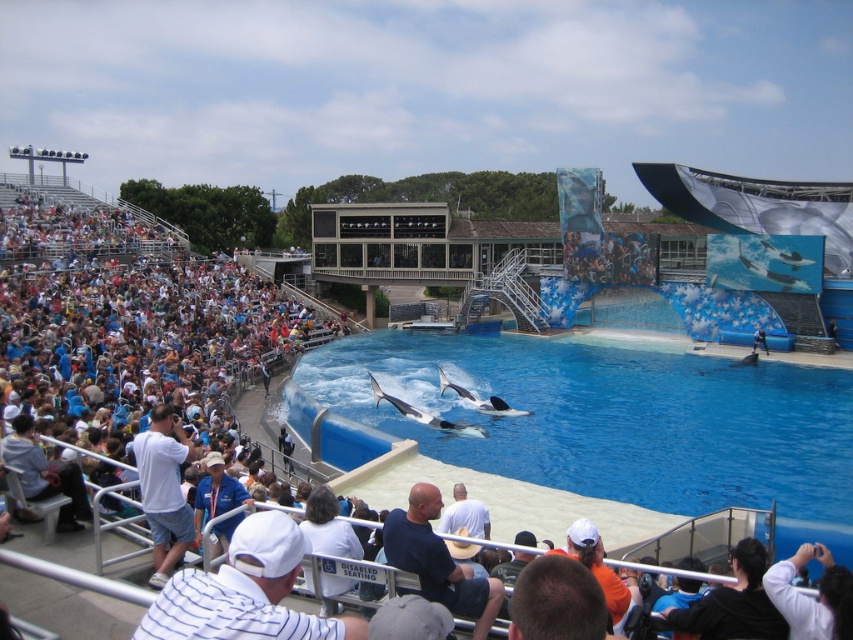
Which of these two, dark blue shirt at lower center or white smooth dolphin at center, stands taller?

dark blue shirt at lower center

Which is behind, point (384, 545) or point (442, 372)?

The point (442, 372) is more distant.

Locate an element on the screen. dark blue shirt at lower center is located at coordinates (438, 561).

Is blue smooth water at center positioned behind white cotton shirt at center?

Yes.

Between blue smooth water at center and white cotton shirt at center, which one appears on the left side from the viewer's perspective?

Positioned to the left is white cotton shirt at center.

The image size is (853, 640). Identify the location of blue smooth water at center. (614, 422).

I want to click on blue smooth water at center, so click(614, 422).

Is point (576, 518) closer to viewer compared to point (379, 387)?

Yes, it is in front of point (379, 387).

Does orange t-shirt at lower center have a larger size compared to white smooth whale at center?

Actually, orange t-shirt at lower center might be smaller than white smooth whale at center.

Is point (619, 605) less distant than point (445, 422)?

Yes, point (619, 605) is closer to viewer.

This screenshot has height=640, width=853. I want to click on orange t-shirt at lower center, so click(596, 566).